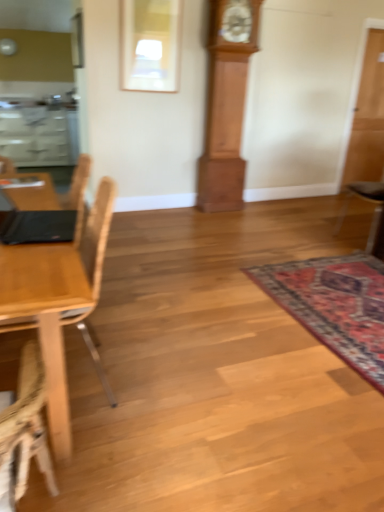
Question: From a real-world perspective, is carpeted rug at lower right positioned above or below transparent glass door at right?

Choices:
 (A) below
 (B) above

Answer: (A)

Question: In the image, is carpeted rug at lower right positioned in front of or behind transparent glass door at right?

Choices:
 (A) front
 (B) behind

Answer: (A)

Question: Estimate the real-world distances between objects in this image. Which object is closer to the black leather chair at right, which ranks as the first chair in back-to-front order?

Choices:
 (A) carpeted rug at lower right
 (B) wooden grandfather clock at center
 (C) light wood chair at left, which is counted as the second chair, starting from the right
 (D) transparent glass door at right

Answer: (D)

Question: Which object is positioned closest to the black leather chair at right, the second chair from the left?

Choices:
 (A) transparent glass door at right
 (B) wooden grandfather clock at center
 (C) carpeted rug at lower right
 (D) light wood chair at left, marked as the 1th chair in a front-to-back arrangement

Answer: (A)